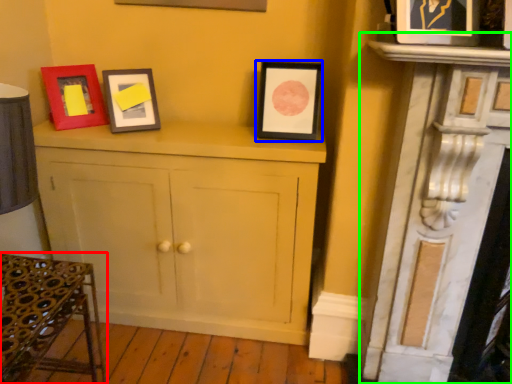
Question: Which object is positioned closest to furniture (highlighted by a red box)? Select from picture frame (highlighted by a blue box) and fireplace (highlighted by a green box).

Choices:
 (A) picture frame
 (B) fireplace

Answer: (A)